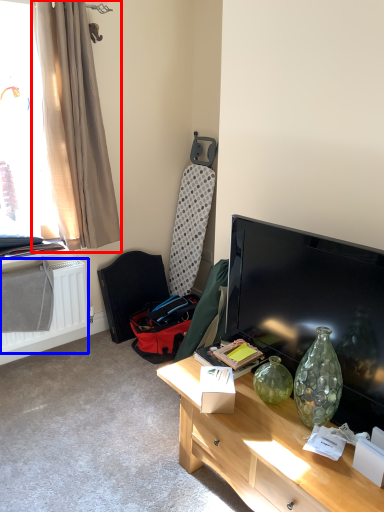
Question: Which object is closer to the camera taking this photo, curtain (highlighted by a red box) or radiator (highlighted by a blue box)?

Choices:
 (A) curtain
 (B) radiator

Answer: (A)